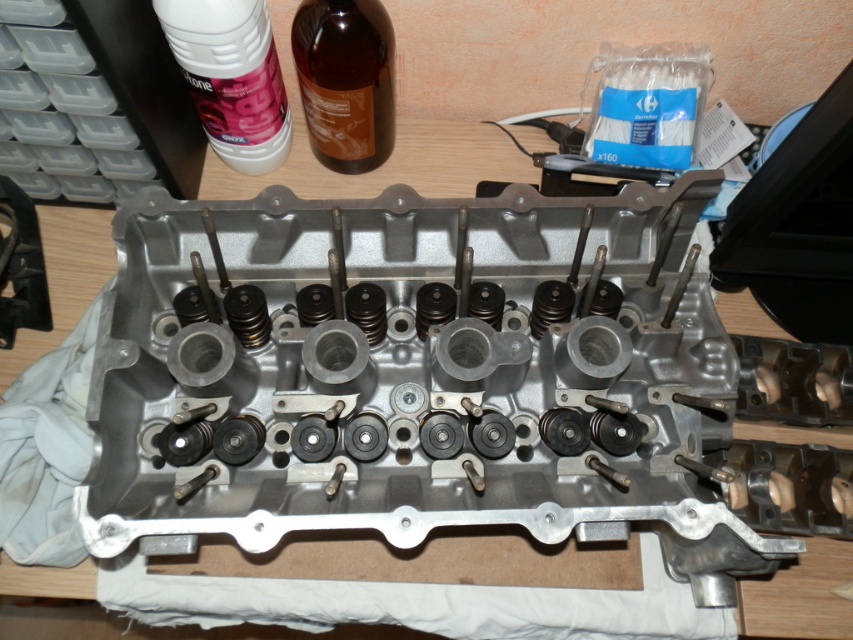
Who is positioned more to the right, white plastic bottle at upper left or brown glass bottle at upper center?

Positioned to the right is brown glass bottle at upper center.

Does white plastic bottle at upper left have a larger size compared to brown glass bottle at upper center?

Yes, white plastic bottle at upper left is bigger than brown glass bottle at upper center.

Locate an element on the screen. The height and width of the screenshot is (640, 853). white plastic bottle at upper left is located at coordinates (231, 77).